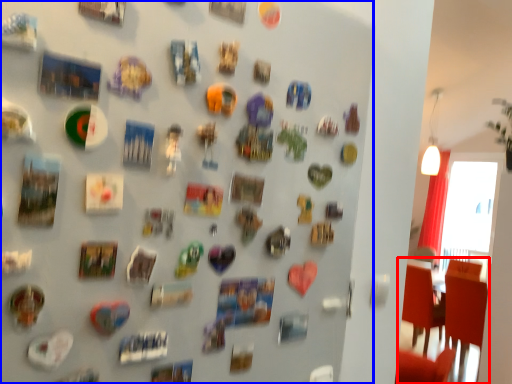
Question: Among these objects, which one is nearest to the camera, chair (highlighted by a red box) or collection (highlighted by a blue box)?

Choices:
 (A) chair
 (B) collection

Answer: (B)